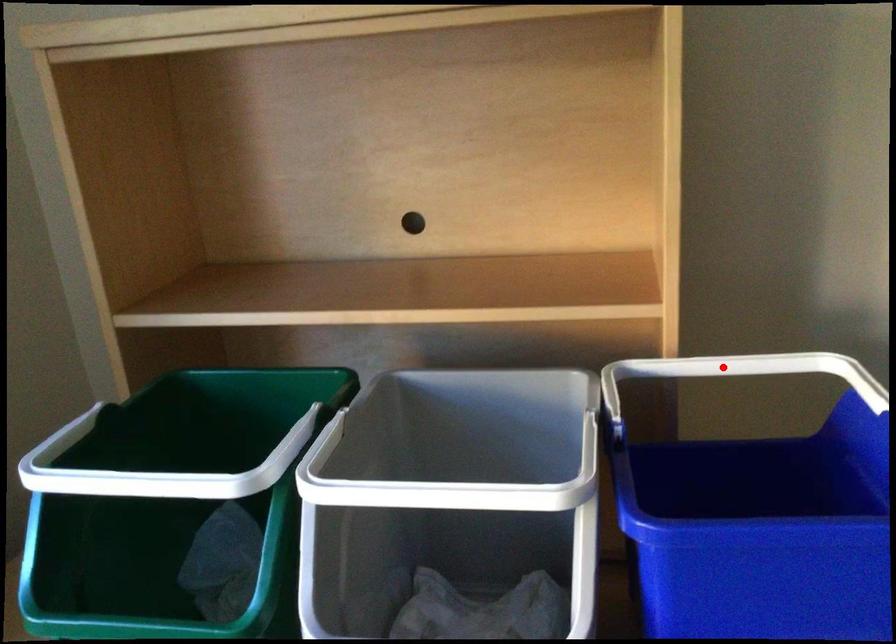
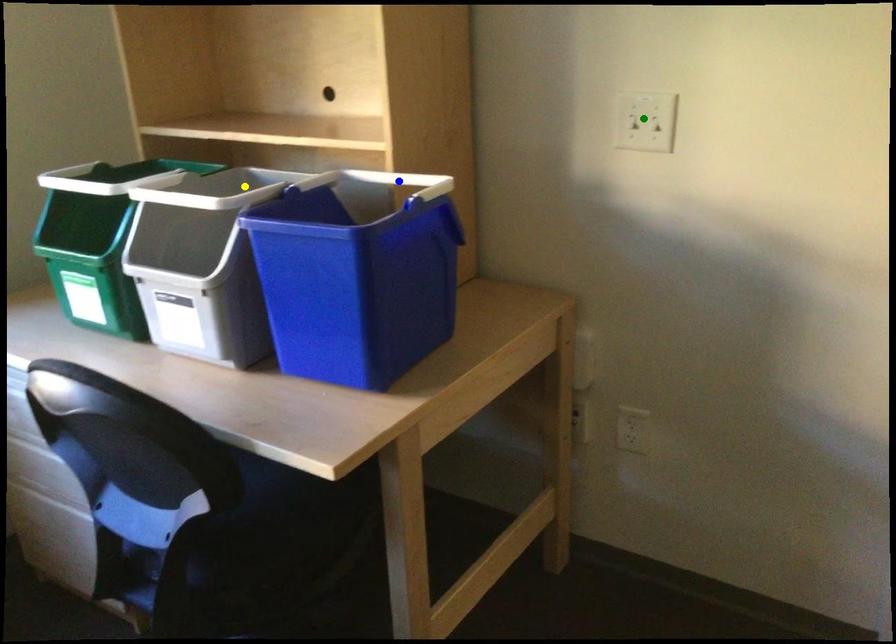
Question: I am providing you with two images of the same scene from different viewpoints. A red point is marked on the first image. You are given multiple points on the second image. Which mark in image 2 goes with the point in image 1?

Choices:
 (A) green point
 (B) yellow point
 (C) blue point

Answer: (C)